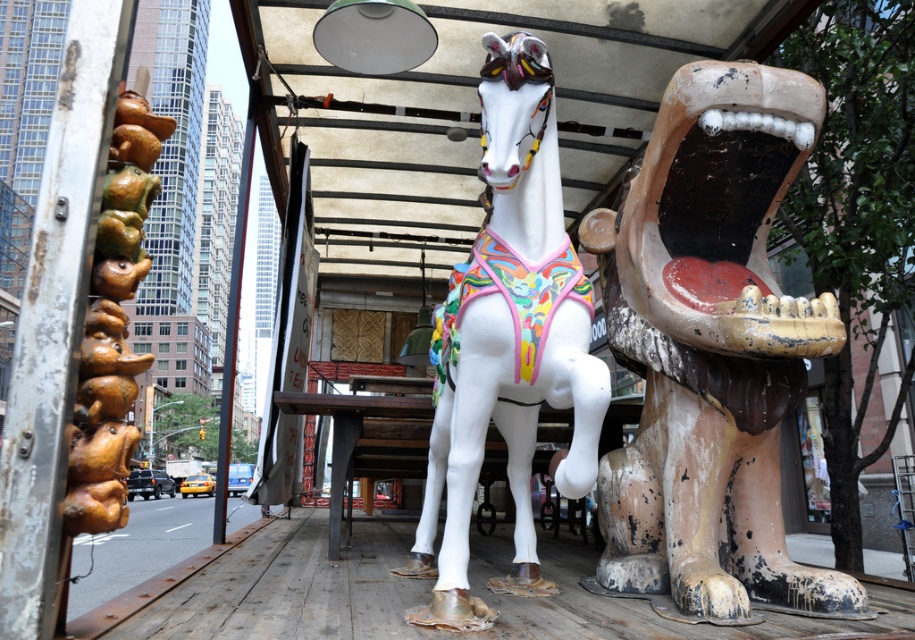
Question: In this image, where is painted wood lion at right located relative to white glossy horse at center?

Choices:
 (A) right
 (B) left

Answer: (A)

Question: Considering the real-world distances, which object is closest to the brown glazed ceramic dog at left?

Choices:
 (A) painted wood lion at right
 (B) white glossy horse at center

Answer: (B)

Question: From the image, what is the correct spatial relationship of painted wood lion at right in relation to brown glazed ceramic dog at left?

Choices:
 (A) left
 (B) right

Answer: (B)

Question: Which object appears closest to the camera in this image?

Choices:
 (A) brown glazed ceramic dog at left
 (B) painted wood lion at right
 (C) white glossy horse at center

Answer: (A)

Question: Which object is farther from the camera taking this photo?

Choices:
 (A) brown glazed ceramic dog at left
 (B) painted wood lion at right

Answer: (B)

Question: Can you confirm if painted wood lion at right is bigger than white glossy horse at center?

Choices:
 (A) yes
 (B) no

Answer: (B)